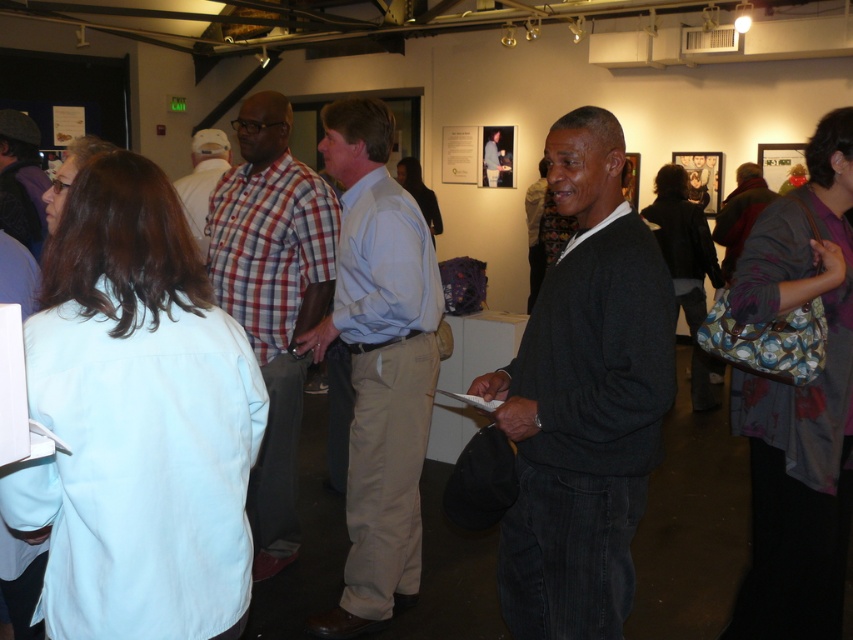
Question: Which of the following is the closest to the observer?

Choices:
 (A) plaid fabric shirt at center
 (B) checkered fabric shirt at center
 (C) light blue shirt at center
 (D) matte black sweater at center

Answer: (C)

Question: Which object is the farthest from the matte black sweater at center?

Choices:
 (A) plaid fabric shirt at center
 (B) checkered fabric shirt at center
 (C) dark gray sweater at center
 (D) light blue shirt at center

Answer: (C)

Question: Does plaid fabric shirt at center have a lesser width compared to matte black sweater at center?

Choices:
 (A) no
 (B) yes

Answer: (A)

Question: Can you confirm if dark gray sweater at center is positioned below matte black sweater at center?

Choices:
 (A) no
 (B) yes

Answer: (B)

Question: Can you confirm if plaid fabric shirt at center is thinner than matte black sweater at center?

Choices:
 (A) no
 (B) yes

Answer: (A)

Question: Which object is the farthest from the matte black sweater at center?

Choices:
 (A) light blue shirt at center
 (B) checkered fabric shirt at center
 (C) plaid fabric shirt at center
 (D) dark gray sweater at center

Answer: (D)